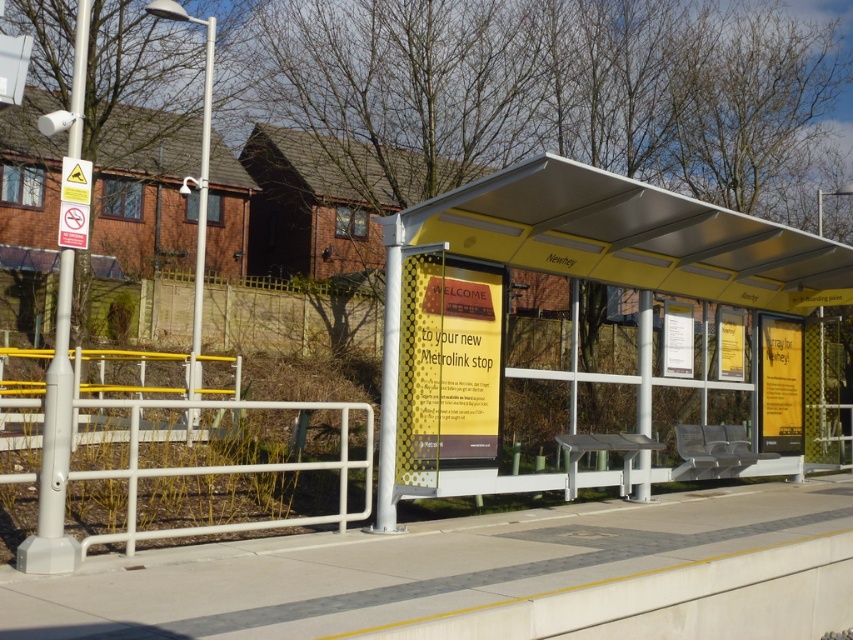
Question: Can you confirm if brick wall at left is wider than white metal/rail at lower left?

Choices:
 (A) no
 (B) yes

Answer: (A)

Question: Does smooth concrete pavement at center appear under metallic yellow canopy at center?

Choices:
 (A) no
 (B) yes

Answer: (B)

Question: Which is farther from the metallic yellow bus stop at center?

Choices:
 (A) brick wall at left
 (B) smooth concrete pavement at center
 (C) metallic yellow canopy at center
 (D) white metal/rail at lower left

Answer: (A)

Question: Which object appears closest to the camera in this image?

Choices:
 (A) white metal/rail at lower left
 (B) smooth concrete pavement at center
 (C) metallic yellow bus stop at center
 (D) metallic yellow canopy at center

Answer: (B)

Question: Is metallic yellow bus stop at center closer to the viewer compared to smooth concrete pavement at center?

Choices:
 (A) no
 (B) yes

Answer: (A)

Question: Considering the real-world distances, which object is farthest from the metallic yellow canopy at center?

Choices:
 (A) smooth concrete pavement at center
 (B) brick wall at left

Answer: (B)